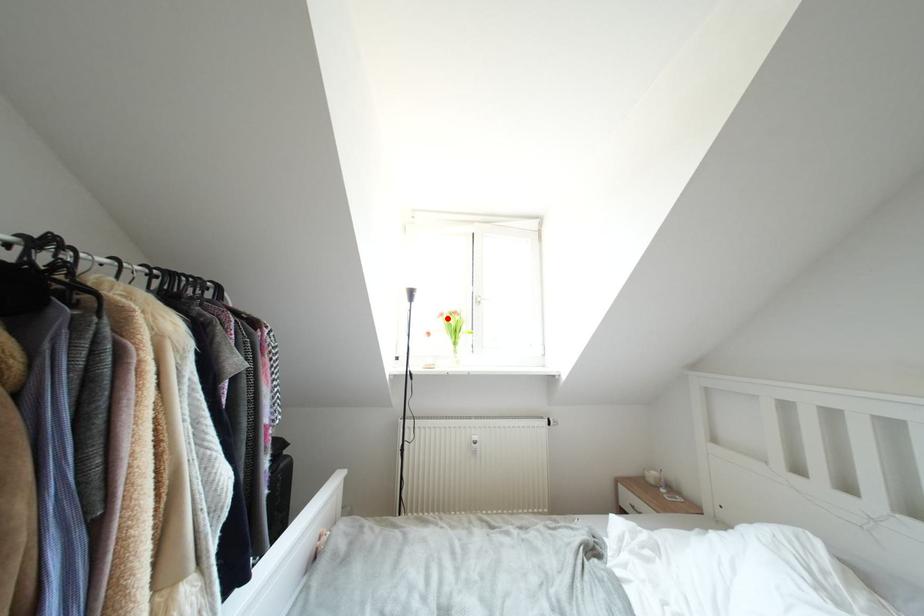
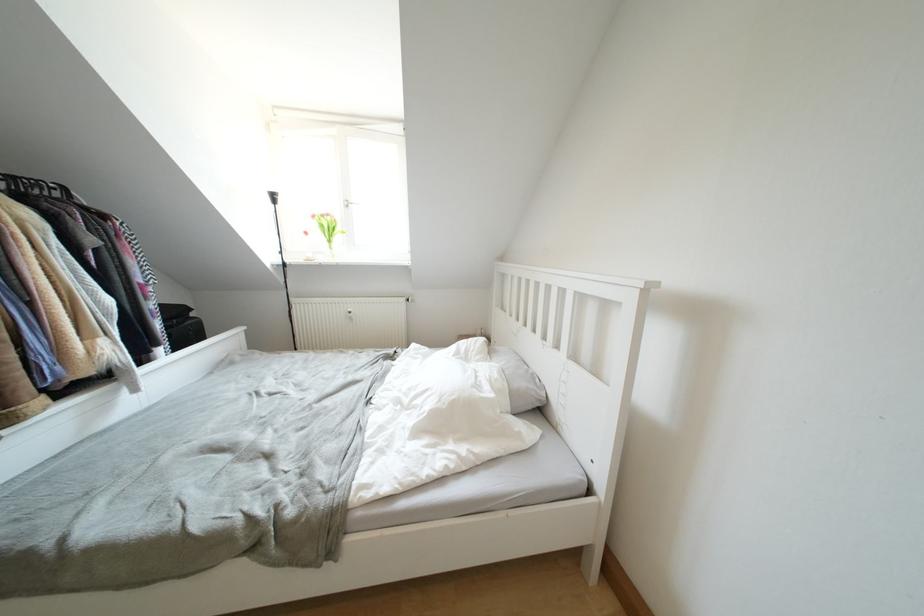
Question: I am providing you with two images of the same scene from different viewpoints. A red point is shown in image1. For the corresponding object point in image2, is it positioned nearer or farther from the camera?

Choices:
 (A) Nearer
 (B) Farther

Answer: (A)